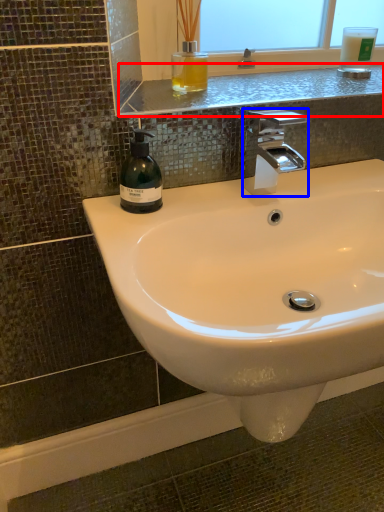
Question: Which point is closer to the camera, window sill (highlighted by a red box) or tap (highlighted by a blue box)?

Choices:
 (A) window sill
 (B) tap

Answer: (B)